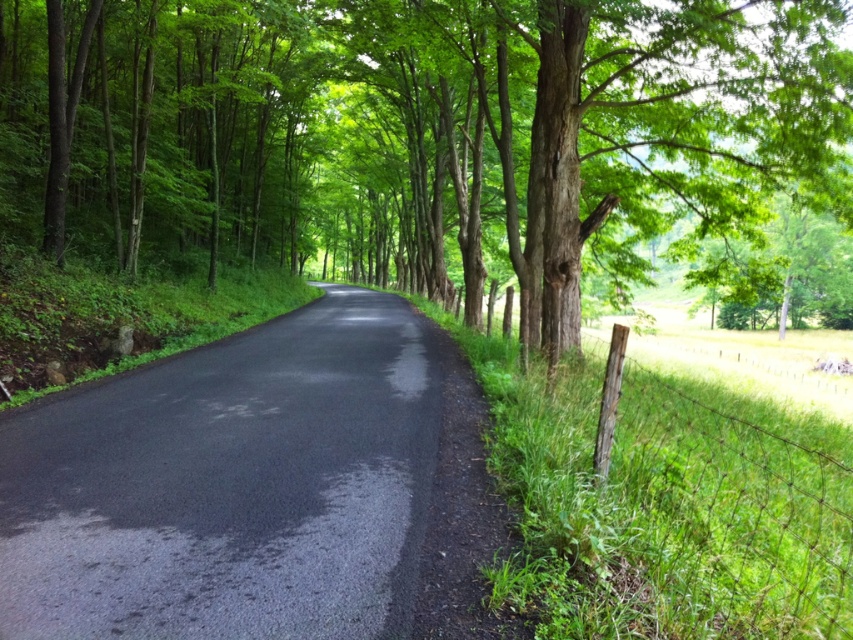
Is green leafy tree at center further to camera compared to black asphalt road at center?

Yes, green leafy tree at center is further from the viewer.

Can you confirm if green leafy tree at center is taller than black asphalt road at center?

Yes, green leafy tree at center is taller than black asphalt road at center.

Between point (679, 67) and point (93, 544), which one is positioned behind?

The point (679, 67) is behind.

Where is `green leafy tree at center`? This screenshot has width=853, height=640. green leafy tree at center is located at coordinates (x=404, y=150).